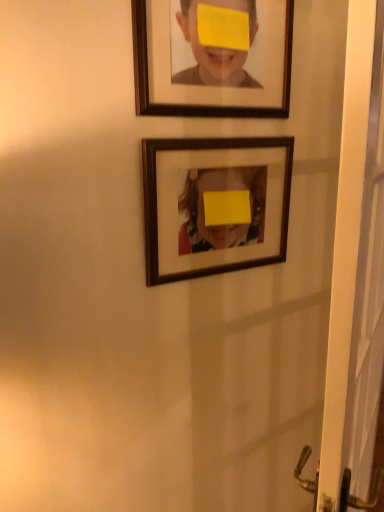
Question: Is wooden frame at upper center, the 2th picture frame in the bottom-to-top sequence, to the right of white plastic screen door at right from the viewer's perspective?

Choices:
 (A) yes
 (B) no

Answer: (B)

Question: Considering the relative sizes of wooden frame at upper center, the 2th picture frame in the bottom-to-top sequence, and white plastic screen door at right in the image provided, is wooden frame at upper center, the 2th picture frame in the bottom-to-top sequence, thinner than white plastic screen door at right?

Choices:
 (A) no
 (B) yes

Answer: (B)

Question: Is the depth of wooden frame at upper center, positioned as the first picture frame in top-to-bottom order, greater than that of white plastic screen door at right?

Choices:
 (A) no
 (B) yes

Answer: (B)

Question: Is white plastic screen door at right completely or partially inside wooden frame at upper center, the 2th picture frame in the bottom-to-top sequence?

Choices:
 (A) no
 (B) yes

Answer: (A)

Question: Is wooden frame at upper center, positioned as the first picture frame in top-to-bottom order, shorter than white plastic screen door at right?

Choices:
 (A) no
 (B) yes

Answer: (B)

Question: From the image's perspective, is wooden frame at upper center, the 2th picture frame in the bottom-to-top sequence, over white plastic screen door at right?

Choices:
 (A) yes
 (B) no

Answer: (A)

Question: Is wooden frame at center, the second picture frame from the top, to the left of white plastic screen door at right from the viewer's perspective?

Choices:
 (A) no
 (B) yes

Answer: (B)

Question: Is wooden frame at center, the second picture frame from the top, wider than white plastic screen door at right?

Choices:
 (A) yes
 (B) no

Answer: (B)

Question: Would you say wooden frame at center, which is counted as the 1th picture frame, starting from the bottom, is outside white plastic screen door at right?

Choices:
 (A) no
 (B) yes

Answer: (B)

Question: Can you confirm if wooden frame at center, the second picture frame from the top, is shorter than white plastic screen door at right?

Choices:
 (A) no
 (B) yes

Answer: (B)

Question: Would you say white plastic screen door at right is part of wooden frame at center, the second picture frame from the top,'s contents?

Choices:
 (A) yes
 (B) no

Answer: (B)

Question: Does wooden frame at center, the second picture frame from the top, have a lesser width compared to white plastic screen door at right?

Choices:
 (A) yes
 (B) no

Answer: (A)

Question: Is white plastic screen door at right not within wooden frame at upper center, positioned as the first picture frame in top-to-bottom order?

Choices:
 (A) yes
 (B) no

Answer: (A)